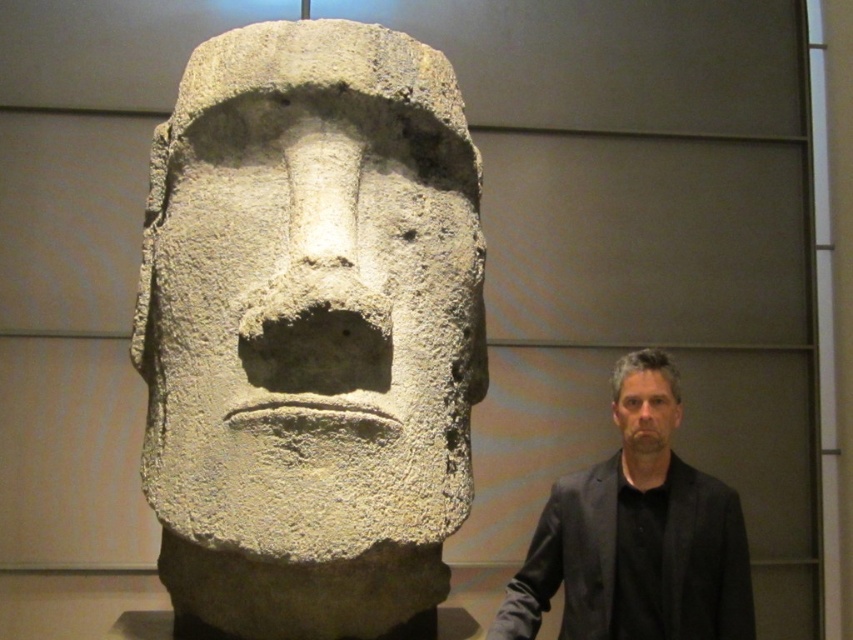
Does point (323, 54) lie behind point (643, 348)?

No, it is in front of (643, 348).

Is white stone sculpture at center further to camera compared to smooth gray stone head at center?

That is False.

The image size is (853, 640). What do you see at coordinates (310, 332) in the screenshot? I see `white stone sculpture at center` at bounding box center [310, 332].

The image size is (853, 640). Find the location of `white stone sculpture at center`. white stone sculpture at center is located at coordinates (310, 332).

Does white stone sculpture at center appear on the right side of gray stone face at right?

Incorrect, white stone sculpture at center is not on the right side of gray stone face at right.

Which is in front, point (469, 272) or point (663, 436)?

Point (469, 272) is more forward.

The width and height of the screenshot is (853, 640). In order to click on white stone sculpture at center in this screenshot , I will do `click(310, 332)`.

Does white stone sculpture at center have a smaller size compared to dark gray suit at right?

No, white stone sculpture at center is not smaller than dark gray suit at right.

Who is positioned more to the left, white stone sculpture at center or dark gray suit at right?

white stone sculpture at center is more to the left.

Find the location of `white stone sculpture at center`. white stone sculpture at center is located at coordinates (310, 332).